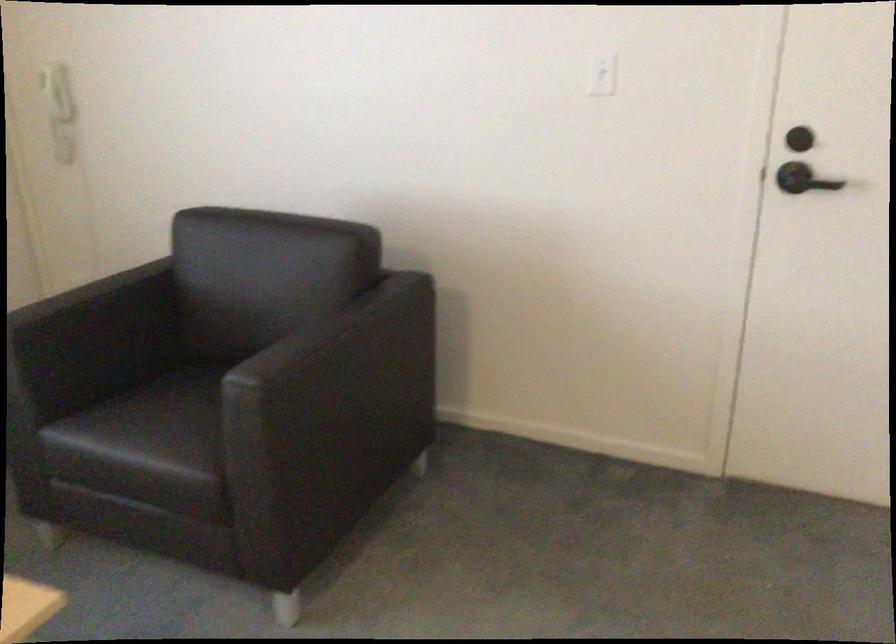
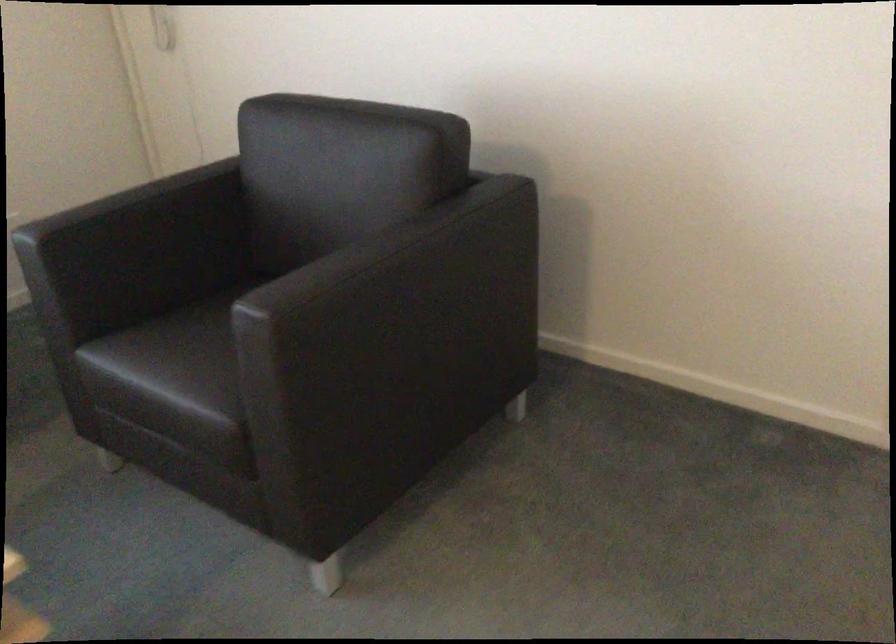
Where in the second image is the point corresponding to pixel 140 438 from the first image?

(168, 366)